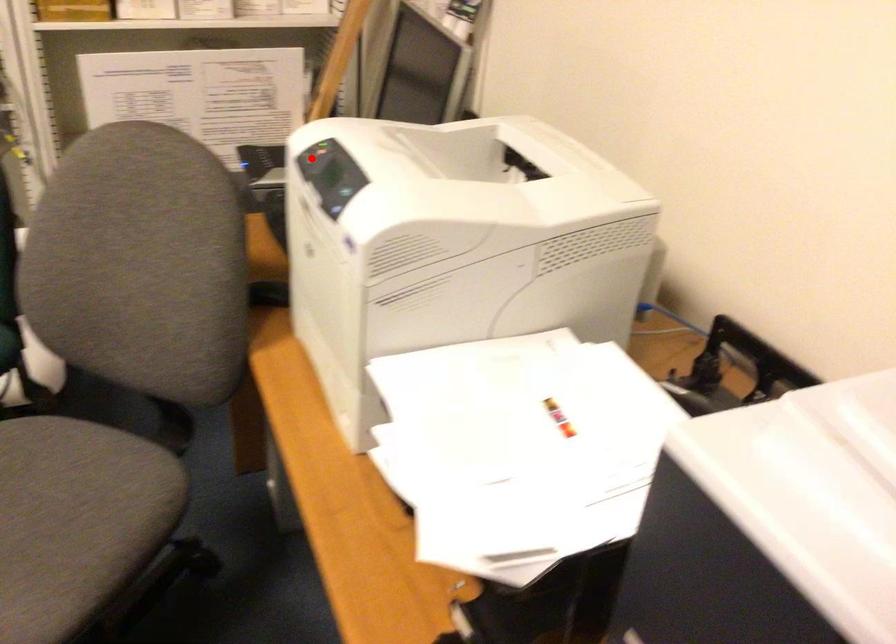
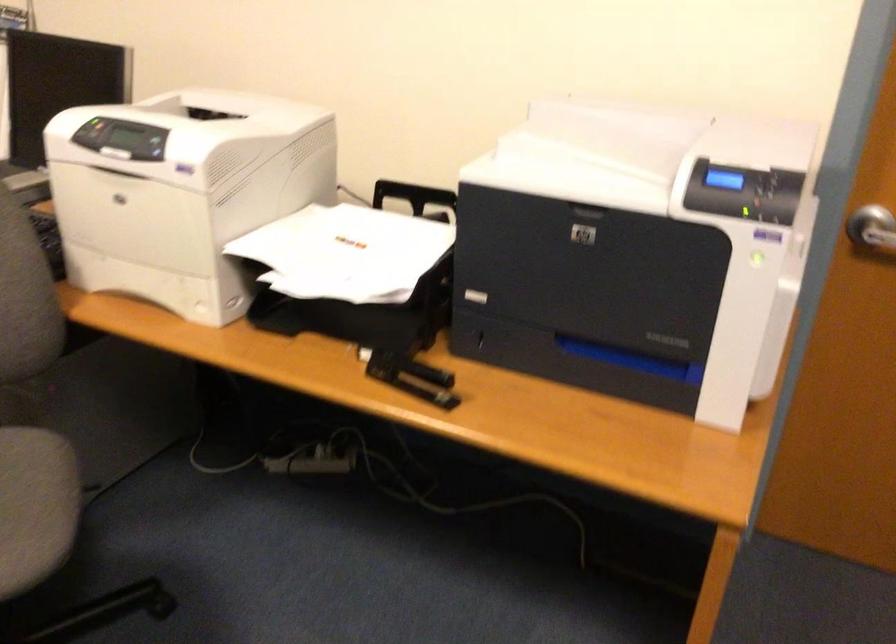
Locate, in the second image, the point that corresponds to the highlighted location in the first image.

(91, 131)